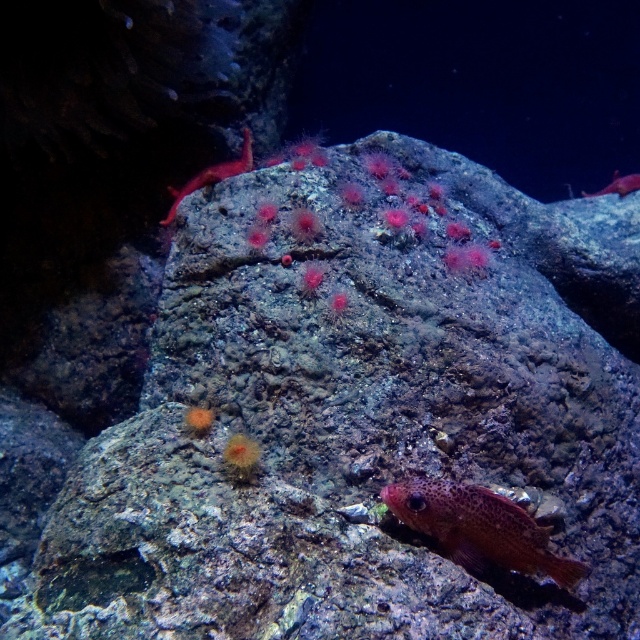
Question: Is translucent pink coral at upper center to the right of smooth red fish at upper right from the viewer's perspective?

Choices:
 (A) no
 (B) yes

Answer: (A)

Question: Which of these objects is positioned closest to the translucent pink coral at upper center?

Choices:
 (A) smooth red fish at upper right
 (B) spotted orange fish at lower right

Answer: (B)

Question: Observing the image, what is the correct spatial positioning of spotted orange fish at lower right in reference to smooth red fish at upper right?

Choices:
 (A) left
 (B) right

Answer: (A)

Question: Which point is farther to the camera?

Choices:
 (A) (218, 172)
 (B) (420, 513)
 (C) (611, 180)

Answer: (C)

Question: Which of the following is the farthest from the observer?

Choices:
 (A) (244, 164)
 (B) (609, 193)
 (C) (458, 502)

Answer: (B)

Question: Can you confirm if spotted orange fish at lower right is thinner than smooth red fish at upper right?

Choices:
 (A) yes
 (B) no

Answer: (B)